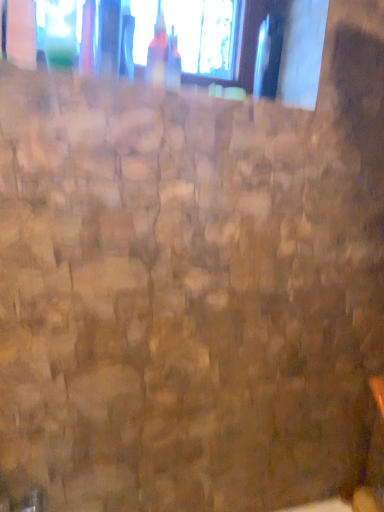
Question: From the image's perspective, is translucent glass bottle at upper center above or below transparent glass window at upper center?

Choices:
 (A) below
 (B) above

Answer: (A)

Question: From a real-world perspective, is translucent glass bottle at upper center physically located above or below transparent glass window at upper center?

Choices:
 (A) above
 (B) below

Answer: (B)

Question: Is translucent glass bottle at upper center bigger or smaller than transparent glass window at upper center?

Choices:
 (A) small
 (B) big

Answer: (A)

Question: Considering their positions, is transparent glass window at upper center located in front of or behind translucent glass bottle at upper center?

Choices:
 (A) front
 (B) behind

Answer: (B)

Question: Considering the relative positions of transparent glass window at upper center and translucent glass bottle at upper center in the image provided, is transparent glass window at upper center to the left or to the right of translucent glass bottle at upper center?

Choices:
 (A) right
 (B) left

Answer: (A)

Question: From the image's perspective, is transparent glass window at upper center located above or below translucent glass bottle at upper center?

Choices:
 (A) below
 (B) above

Answer: (B)

Question: Looking at the image, does transparent glass window at upper center seem bigger or smaller compared to translucent glass bottle at upper center?

Choices:
 (A) big
 (B) small

Answer: (A)